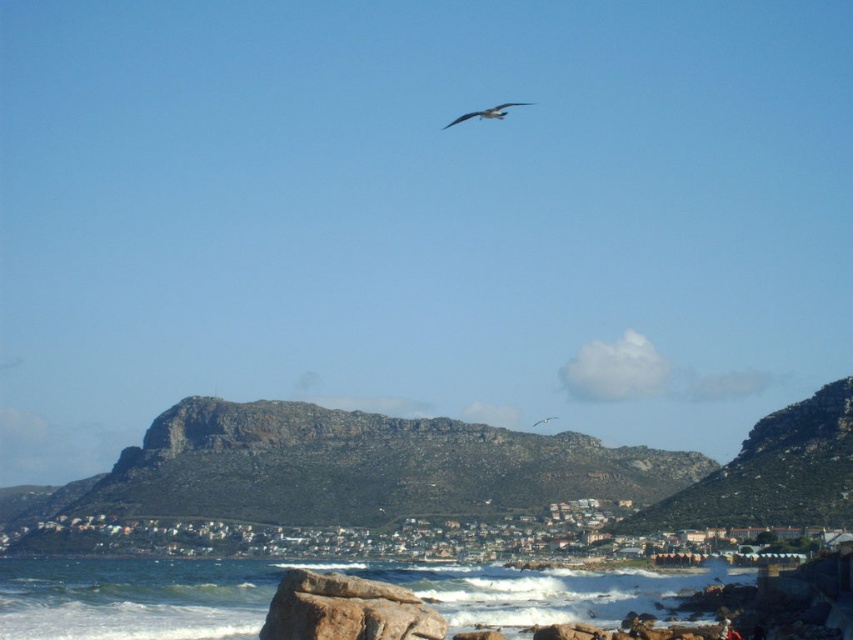
You are an ornithologist observing two birds in the sky. You see a white feathered bird at upper center and a gray feathered bird at upper center. Which bird is flying higher?

The white feathered bird at upper center is flying higher than the gray feathered bird at upper center.